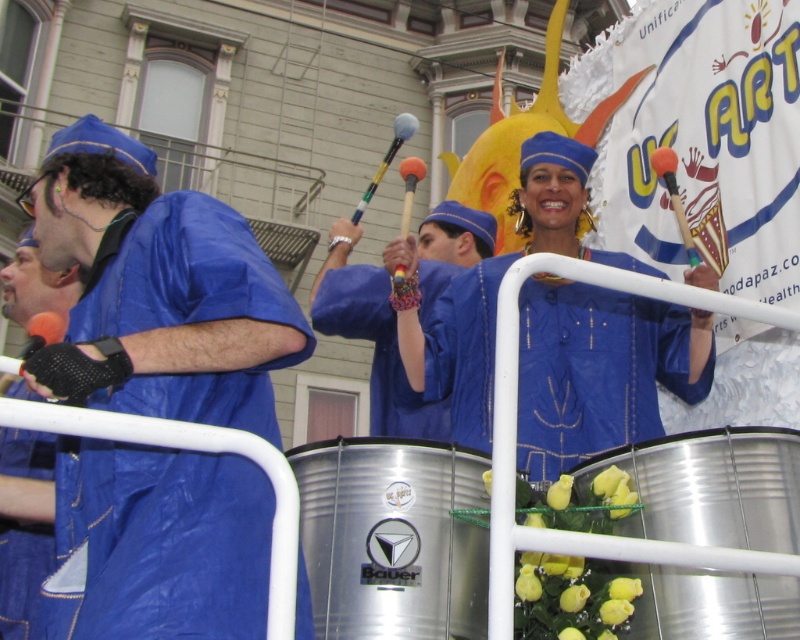
You are a photographer standing at the front of the parade. You want to capture a closeup shot of the blue shiny fabric at center. Given that your camera has a minimum focusing distance of 15 meters, will you be able to take the photo?

The blue shiny fabric at center is 17.20 meters away from the camera. Since the minimum focusing distance is 15 meters, the camera can focus on the blue shiny fabric at center as it is beyond the minimum requirement.